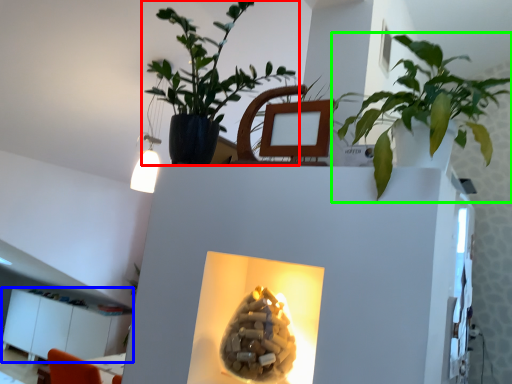
Question: Which object is the farthest from houseplant (highlighted by a red box)? Choose among these: furniture (highlighted by a blue box) or houseplant (highlighted by a green box).

Choices:
 (A) furniture
 (B) houseplant

Answer: (A)